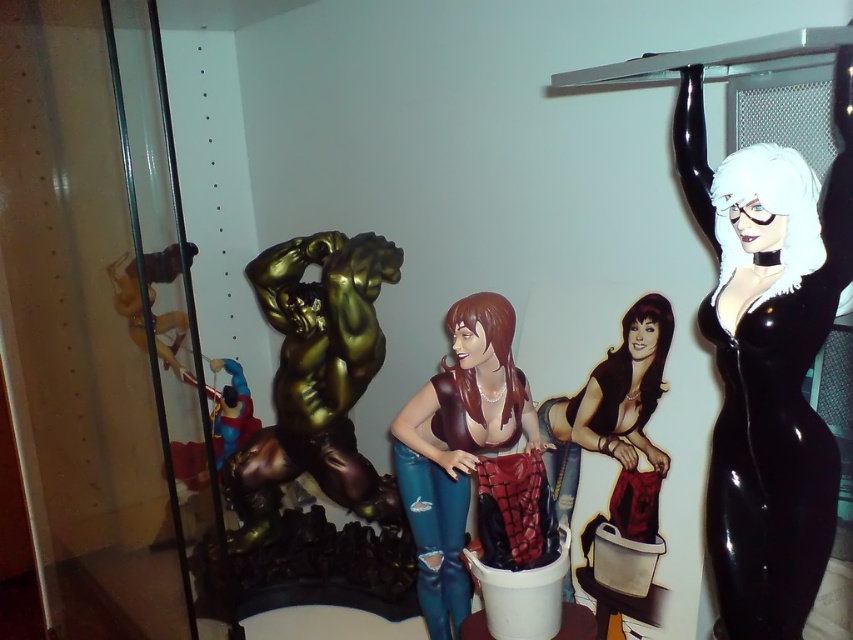
You are standing in front of a display case with two points marked on its surface. The first point is at coordinate point (503, 387) and the second at point (181, 372). Which point is closer to you?

Point (503, 387) is closer to the viewer than point (181, 372).

You are an interior designer arranging a display. You have two items to place on a shelf in front of you. The items are the matte brown hair at center and the shiny gold figure at center. According to the scene, where should you position them relative to each other?

The matte brown hair at center should be placed below the shiny gold figure at center as per the scene description.